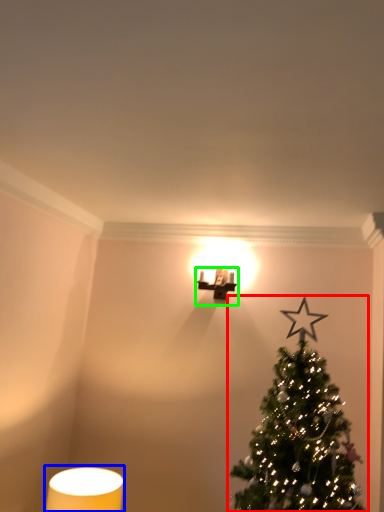
Question: Based on their relative distances, which object is nearer to christmas tree (highlighted by a red box)? Choose from table lamp (highlighted by a blue box) and table lamp (highlighted by a green box).

Choices:
 (A) table lamp
 (B) table lamp

Answer: (A)